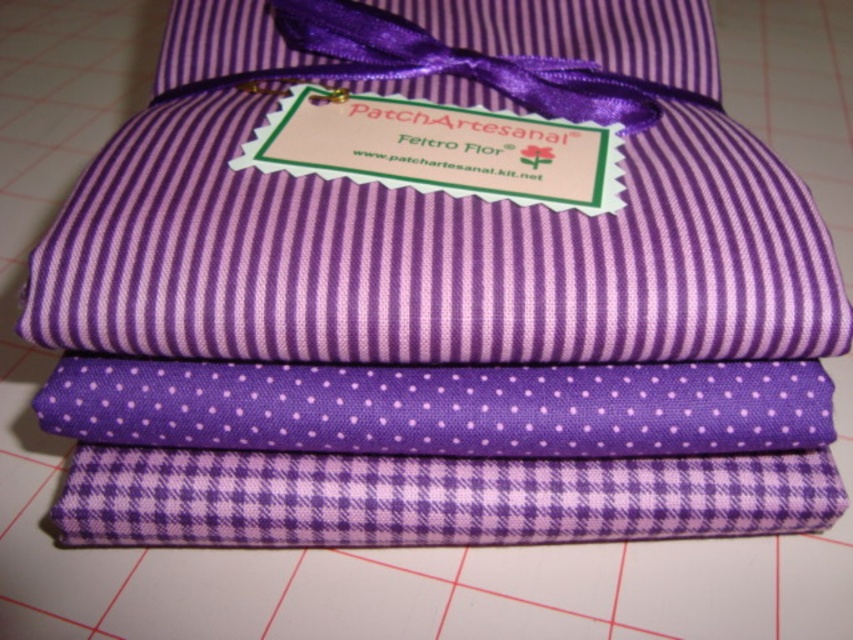
Is matte purple fabric at center to the right of purple dotted fabric at center from the viewer's perspective?

In fact, matte purple fabric at center is to the left of purple dotted fabric at center.

Is matte purple fabric at center wider than purple dotted fabric at center?

Indeed, matte purple fabric at center has a greater width compared to purple dotted fabric at center.

Is point (662, 272) behind point (204, 426)?

No, it is in front of (204, 426).

At what (x,y) coordinates should I click in order to perform the action: click on matte purple fabric at center. Please return your answer as a coordinate pair (x, y). The image size is (853, 640). Looking at the image, I should click on (434, 216).

Who is higher up, matte purple fabric at center or purple checkered fabric at bottom?

matte purple fabric at center is above.

Who is more forward, [196,177] or [398,522]?

Point [398,522] is more forward.

Between point (432, 253) and point (761, 508), which one is positioned behind?

Point (761, 508)

Where is `matte purple fabric at center`? The image size is (853, 640). matte purple fabric at center is located at coordinates (434, 216).

Which is in front, point (497, 392) or point (807, 497)?

Positioned in front is point (497, 392).

Is purple dotted fabric at center shorter than purple checkered fabric at bottom?

Indeed, purple dotted fabric at center has a lesser height compared to purple checkered fabric at bottom.

Is point (589, 387) farther from viewer compared to point (802, 529)?

No, (589, 387) is in front of (802, 529).

Image resolution: width=853 pixels, height=640 pixels. Find the location of `purple dotted fabric at center`. purple dotted fabric at center is located at coordinates (442, 406).